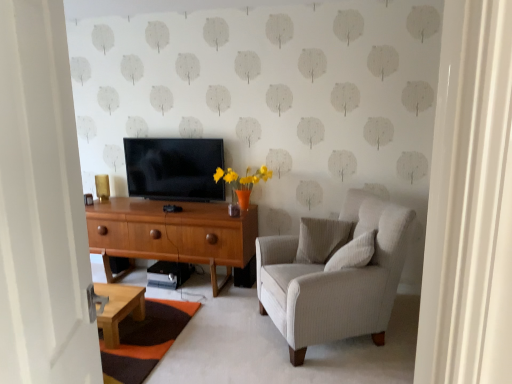
At what (x,y) coordinates should I click in order to perform the action: click on flat screen tv at center. Please return your answer as a coordinate pair (x, y). The height and width of the screenshot is (384, 512). Looking at the image, I should click on (174, 168).

Measure the distance between point (18, 75) and camera.

The distance of point (18, 75) from camera is 35.59 inches.

Identify the location of light gray fabric armchair at right. coord(335,280).

Where is `the 1st pillow above the light gray fabric armchair at right (from the image's perspective)`? The image size is (512, 384). the 1st pillow above the light gray fabric armchair at right (from the image's perspective) is located at coordinates (353, 253).

Does light gray fabric armchair at right contain white textured pillow at center, which ranks as the second pillow in back-to-front order?

Yes, white textured pillow at center, which ranks as the second pillow in back-to-front order, is a part of light gray fabric armchair at right.

Based on the photo, between light gray fabric armchair at right and white textured pillow at center, which ranks as the second pillow in back-to-front order, which one has larger width?

light gray fabric armchair at right is wider.

Based on their positions, is light gray fabric armchair at right located to the left or right of white textured pillow at center, which ranks as the second pillow in back-to-front order?

light gray fabric armchair at right is to the left of white textured pillow at center, which ranks as the second pillow in back-to-front order.

Based on their positions, is white wooden door at left located to the left or right of flat screen tv at center?

Based on their positions, white wooden door at left is located to the right of flat screen tv at center.

From the image's perspective, which is above, white wooden door at left or flat screen tv at center?

flat screen tv at center appears higher in the image.

Which object is closer to the camera, white wooden door at left or flat screen tv at center?

white wooden door at left.

Is there a large distance between white wooden door at left and flat screen tv at center?

white wooden door at left is far away from flat screen tv at center.

Is light gray fabric armchair at right shorter than flat screen tv at center?

In fact, light gray fabric armchair at right may be taller than flat screen tv at center.

Could flat screen tv at center be considered to be inside light gray fabric armchair at right?

Actually, flat screen tv at center is outside light gray fabric armchair at right.

Does light gray fabric armchair at right have a lesser width compared to flat screen tv at center?

Incorrect, the width of light gray fabric armchair at right is not less than that of flat screen tv at center.

From a real-world perspective, relative to flat screen tv at center, is woodendesk at center vertically above or below?

woodendesk at center is below flat screen tv at center.

In the scene shown: Is woodendesk at center in front of or behind flat screen tv at center in the image?

Visually, woodendesk at center is located in front of flat screen tv at center.

In the scene shown: In terms of height, does woodendesk at center look taller or shorter compared to flat screen tv at center?

woodendesk at center is taller than flat screen tv at center.

Is woodendesk at center inside the boundaries of flat screen tv at center, or outside?

woodendesk at center is not inside flat screen tv at center, it's outside.

Is white wooden door at left not inside light gray fabric armchair at right?

Yes.

Considering their positions, is white wooden door at left located in front of or behind light gray fabric armchair at right?

white wooden door at left is in front of light gray fabric armchair at right.

How many degrees apart are the facing directions of white textured pillow at center, acting as the 2th pillow starting from the front, and woodendesk at center?

white textured pillow at center, acting as the 2th pillow starting from the front, and woodendesk at center are facing 15 degrees away from each other.

From a real-world perspective, between white textured pillow at center, acting as the 2th pillow starting from the front, and woodendesk at center, who is vertically lower?

woodendesk at center.

Looking at this image, looking at the image, does white textured pillow at center, acting as the 2th pillow starting from the front, seem bigger or smaller compared to woodendesk at center?

In the image, white textured pillow at center, acting as the 2th pillow starting from the front, appears to be smaller than woodendesk at center.

Is white textured pillow at center, arranged as the 1th pillow when viewed from the back, shorter than woodendesk at center?

Correct, white textured pillow at center, arranged as the 1th pillow when viewed from the back, is not as tall as woodendesk at center.

Is light gray fabric armchair at right inside or outside of white wooden door at left?

light gray fabric armchair at right is not enclosed by white wooden door at left.

Can you confirm if light gray fabric armchair at right is bigger than white wooden door at left?

Correct, light gray fabric armchair at right is larger in size than white wooden door at left.

Is light gray fabric armchair at right far from white wooden door at left?

Indeed, light gray fabric armchair at right is not near white wooden door at left.

Who is taller, light gray fabric armchair at right or white wooden door at left?

With more height is white wooden door at left.

Starting from the light gray fabric armchair at right, which pillow is the 1st one behind? Please provide its 2D coordinates.

[(353, 253)]

Locate an element on the screen. The height and width of the screenshot is (384, 512). door above the flat screen tv at center (from a real-world perspective) is located at coordinates (41, 206).

Consider the image. When comparing their distances from white textured pillow at center, acting as the 2th pillow starting from the front, does woodendesk at center or white wooden door at left seem closer?

The object closer to white textured pillow at center, acting as the 2th pillow starting from the front, is woodendesk at center.

When comparing their distances from flat screen tv at center, does white textured pillow at center, the 1th pillow in the front-to-back sequence, or light gray fabric armchair at right seem further?

Among the two, white textured pillow at center, the 1th pillow in the front-to-back sequence, is located further to flat screen tv at center.

In the scene shown: From the image, which object appears to be nearer to woodendesk at center, white textured pillow at center, arranged as the 1th pillow when viewed from the back, or white wooden door at left?

Based on the image, white textured pillow at center, arranged as the 1th pillow when viewed from the back, appears to be nearer to woodendesk at center.

When comparing their distances from flat screen tv at center, does white wooden door at left or woodendesk at center seem further?

Based on the image, white wooden door at left appears to be further to flat screen tv at center.

Considering their positions, is white textured pillow at center, which ranks as the second pillow in back-to-front order, positioned closer to white textured pillow at center, acting as the 2th pillow starting from the front, than light gray fabric armchair at right?

light gray fabric armchair at right is closer to white textured pillow at center, acting as the 2th pillow starting from the front.

Based on their spatial positions, is woodendesk at center or white textured pillow at center, acting as the 2th pillow starting from the front, further from flat screen tv at center?

white textured pillow at center, acting as the 2th pillow starting from the front, is further to flat screen tv at center.

When comparing their distances from white textured pillow at center, the 1th pillow in the front-to-back sequence, does light gray fabric armchair at right or flat screen tv at center seem closer?

Based on the image, light gray fabric armchair at right appears to be nearer to white textured pillow at center, the 1th pillow in the front-to-back sequence.

Which object lies nearer to the anchor point white textured pillow at center, the 1th pillow in the front-to-back sequence, light gray fabric armchair at right or woodendesk at center?

light gray fabric armchair at right is positioned closer to the anchor white textured pillow at center, the 1th pillow in the front-to-back sequence.

Where is `chair between white wooden door at left and white textured pillow at center, the 1th pillow in the front-to-back sequence, from front to back`? This screenshot has width=512, height=384. chair between white wooden door at left and white textured pillow at center, the 1th pillow in the front-to-back sequence, from front to back is located at coordinates (335, 280).

The width and height of the screenshot is (512, 384). What are the coordinates of `television located between woodendesk at center and white textured pillow at center, arranged as the 1th pillow when viewed from the back, in the left-right direction` in the screenshot? It's located at [x=174, y=168].

The width and height of the screenshot is (512, 384). Find the location of `chair between flat screen tv at center and white textured pillow at center, which ranks as the second pillow in back-to-front order, in the horizontal direction`. chair between flat screen tv at center and white textured pillow at center, which ranks as the second pillow in back-to-front order, in the horizontal direction is located at coordinates (335, 280).

You are a GUI agent. You are given a task and a screenshot of the screen. Output one action in this format:
    pyautogui.click(x=<x>, y=<y>)
    Task: Click on the chair located between white wooden door at left and white textured pillow at center, arranged as the 1th pillow when viewed from the back, in the depth direction
    
    Given the screenshot: What is the action you would take?
    pyautogui.click(x=335, y=280)